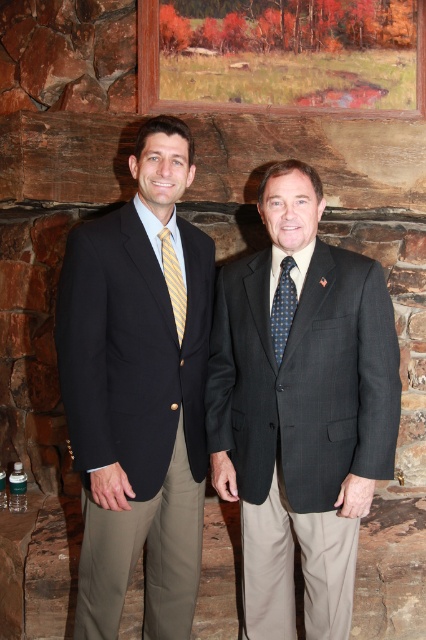
Which of these two, wooden frame at upper center or dark blue dotted tie at center, stands taller?

With more height is wooden frame at upper center.

Does wooden frame at upper center appear on the left side of dark blue dotted tie at center?

No, wooden frame at upper center is not to the left of dark blue dotted tie at center.

Between point (264, 1) and point (278, 337), which one is positioned in front?

Positioned in front is point (278, 337).

Identify the location of wooden frame at upper center. (282, 54).

Between point (359, 429) and point (275, 333), which one is positioned in front?

Positioned in front is point (359, 429).

From the picture: Which is more to the left, dark gray pinstripe suit at center or dark blue dotted tie at center?

dark blue dotted tie at center

Identify the location of dark gray pinstripe suit at center. (302, 426).

This screenshot has width=426, height=640. What are the coordinates of `dark gray pinstripe suit at center` in the screenshot? It's located at (302, 426).

The height and width of the screenshot is (640, 426). Describe the element at coordinates (301, 410) in the screenshot. I see `black textured suit at center` at that location.

Between point (264, 515) and point (172, 408), which one is positioned behind?

The point (264, 515) is more distant.

Locate an element on the screen. This screenshot has height=640, width=426. black textured suit at center is located at coordinates (301, 410).